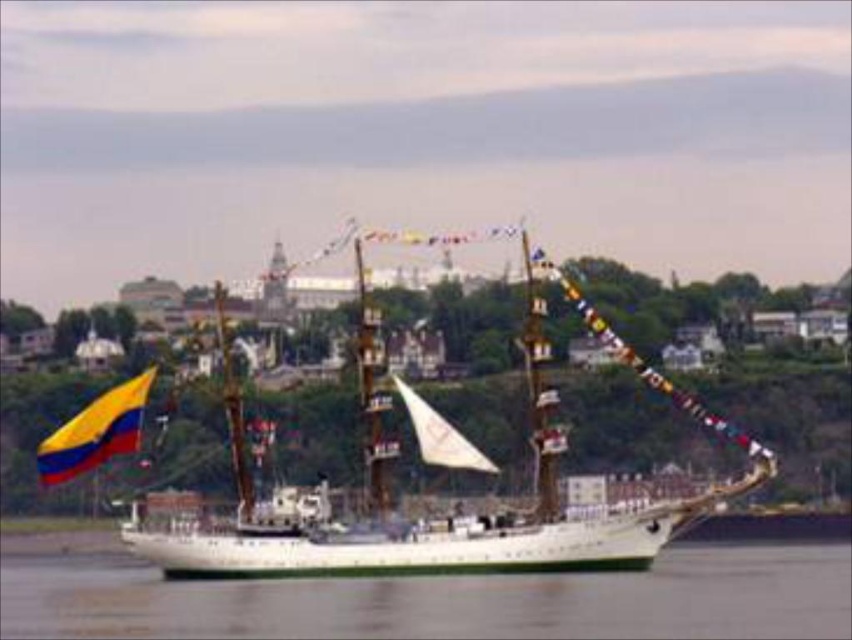
Who is positioned more to the right, white water at center or white wooden ship at center?

white wooden ship at center

Which is in front, point (464, 598) or point (533, 404)?

Point (464, 598)

Where is `white water at center`? This screenshot has width=852, height=640. white water at center is located at coordinates (444, 600).

Is white wooden ship at center above yellowmaterial/textureflag at left?

Correct, white wooden ship at center is located above yellowmaterial/textureflag at left.

Is white wooden ship at center to the right of yellowmaterial/textureflag at left from the viewer's perspective?

Indeed, white wooden ship at center is positioned on the right side of yellowmaterial/textureflag at left.

Measure the distance between point (550, 442) and camera.

Point (550, 442) is 1155.47 feet from camera.

What are the coordinates of `white wooden ship at center` in the screenshot? It's located at (452, 525).

Who is higher up, white water at center or yellowmaterial/textureflag at left?

yellowmaterial/textureflag at left is above.

Does white water at center appear on the right side of yellowmaterial/textureflag at left?

Yes, white water at center is to the right of yellowmaterial/textureflag at left.

Between point (432, 611) and point (72, 428), which one is positioned in front?

Point (432, 611)

This screenshot has height=640, width=852. In order to click on white water at center in this screenshot , I will do `click(444, 600)`.